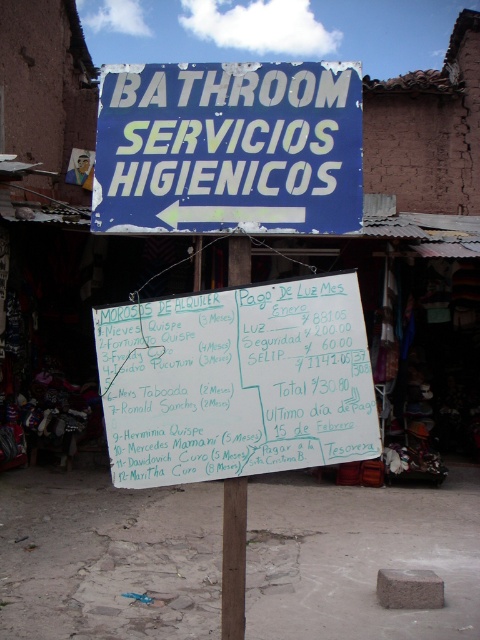
Between green paperboard at center and white paper sign at center, which one has more height?

With more height is green paperboard at center.

Between point (348, 445) and point (228, 280), which one is positioned behind?

Positioned behind is point (228, 280).

Where is `green paperboard at center`? green paperboard at center is located at coordinates (237, 381).

Is point (128, 355) in front of point (121, 92)?

Yes, point (128, 355) is in front of point (121, 92).

Can you confirm if green paperboard at center is positioned to the left of blue painted board at upper center?

Incorrect, green paperboard at center is not on the left side of blue painted board at upper center.

Which is in front, point (179, 326) or point (254, 196)?

Point (179, 326) is in front.

Where is `green paperboard at center`? green paperboard at center is located at coordinates (237, 381).

Does blue painted board at upper center lie in front of white paper sign at center?

Yes, it is in front of white paper sign at center.

Is blue painted board at upper center shorter than white paper sign at center?

No, blue painted board at upper center is not shorter than white paper sign at center.

Is point (112, 176) positioned before point (245, 493)?

No, it is not.

Where is `blue painted board at upper center`? The image size is (480, 640). blue painted board at upper center is located at coordinates (228, 147).